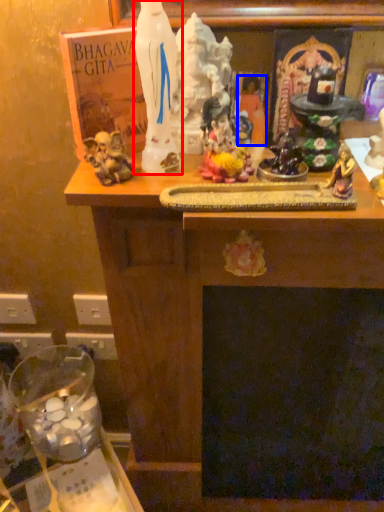
Question: Which of the following is the closest to the observer, statue (highlighted by a red box) or person (highlighted by a blue box)?

Choices:
 (A) statue
 (B) person

Answer: (A)